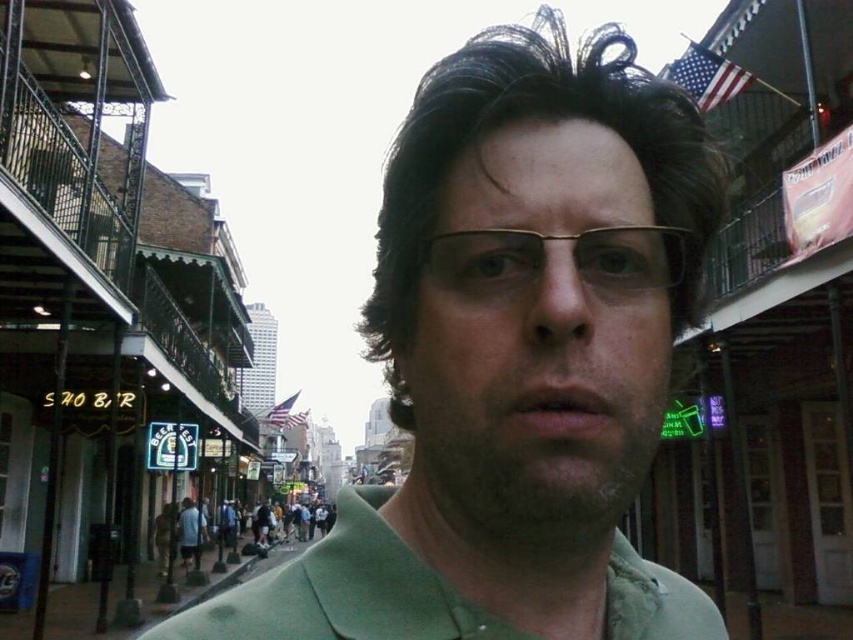
Question: Which object is positioned farthest from the dark clothing at center?

Choices:
 (A) green matte shirt at center
 (B) green cotton shirt at center
 (C) dark brown textured hair at center

Answer: (C)

Question: Which point is farther to the camera?

Choices:
 (A) (186, 497)
 (B) (534, 54)
 (C) (248, 566)

Answer: (A)

Question: Can you confirm if green matte shirt at center is bigger than dark brown textured hair at center?

Choices:
 (A) no
 (B) yes

Answer: (B)

Question: Is green matte shirt at center smaller than dark brown textured hair at center?

Choices:
 (A) no
 (B) yes

Answer: (A)

Question: Is green matte shirt at center further to camera compared to green cotton shirt at center?

Choices:
 (A) yes
 (B) no

Answer: (B)

Question: Which point appears farthest from the camera in this image?

Choices:
 (A) (657, 376)
 (B) (519, 294)

Answer: (A)